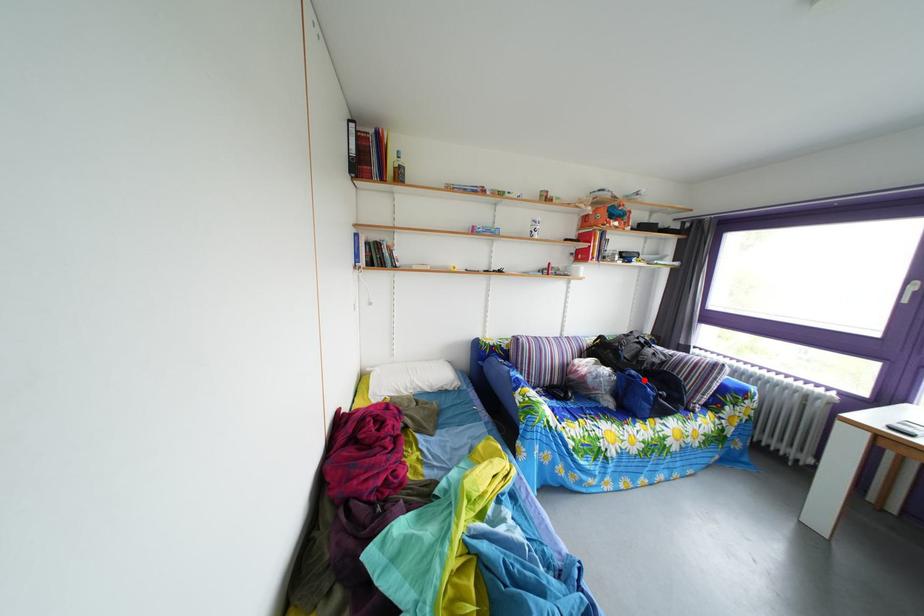
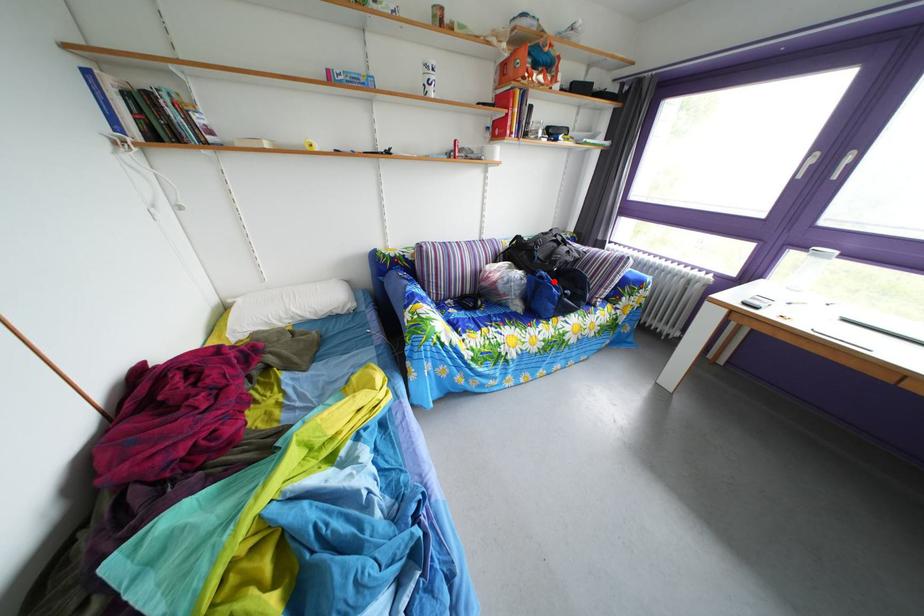
I am providing you with two images of the same scene from different viewpoints. A red point is marked on the first image and another point is marked on the second image. Are the points marked in image1 and image2 representing the same 3D position?

Yes